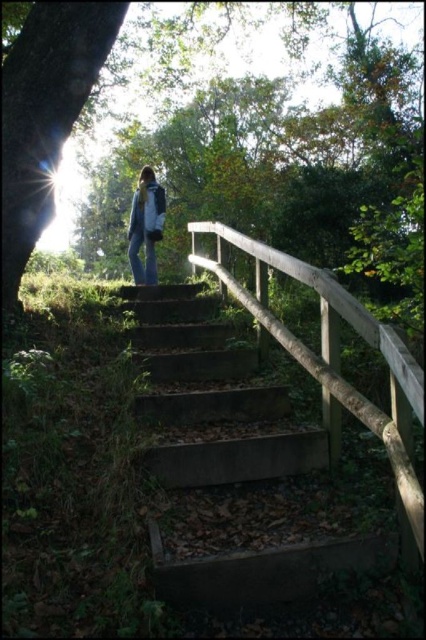
Who is shorter, concrete stairs at center or wooden textured rail at center?

concrete stairs at center

Image resolution: width=426 pixels, height=640 pixels. Describe the element at coordinates (210, 396) in the screenshot. I see `concrete stairs at center` at that location.

In order to click on concrete stairs at center in this screenshot , I will do `click(210, 396)`.

Does smooth bark tree at left lie in front of denim jacket at center?

Yes, it is.

Identify the location of smooth bark tree at left. This screenshot has width=426, height=640. (45, 115).

Is point (154, 424) closer to camera compared to point (152, 220)?

Yes, point (154, 424) is in front of point (152, 220).

Is concrete stairs at center below denim jacket at center?

Indeed, concrete stairs at center is positioned under denim jacket at center.

At what (x,y) coordinates should I click in order to perform the action: click on concrete stairs at center. Please return your answer as a coordinate pair (x, y). Looking at the image, I should click on (210, 396).